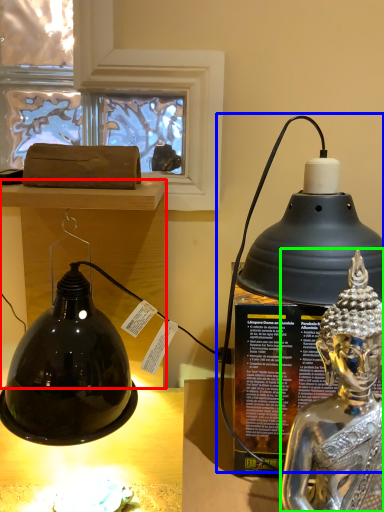
Question: Considering the real-world distances, which object is closest to furniture (highlighted by a red box)? oil lamp (highlighted by a blue box) or person (highlighted by a green box).

Choices:
 (A) oil lamp
 (B) person

Answer: (A)